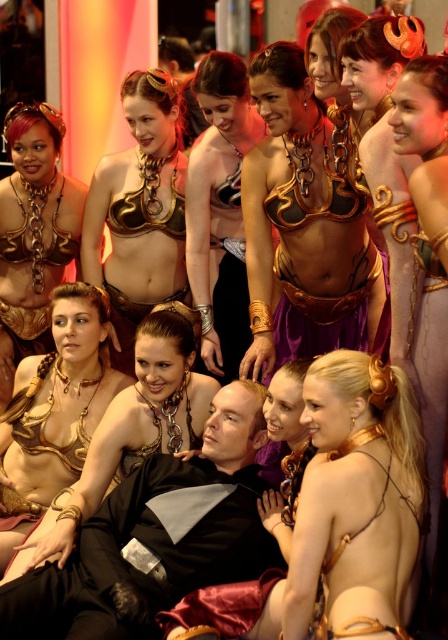
Question: Is gold chainmail bikini at center bigger than metallic gold bikini top at center?

Choices:
 (A) yes
 (B) no

Answer: (B)

Question: Which of the following is the farthest from the observer?

Choices:
 (A) (360, 145)
 (B) (153, 506)
 (C) (405, 104)
 (D) (56, 195)

Answer: (D)

Question: Is black matte suit at center smaller than metallic gold bikini top at center?

Choices:
 (A) no
 (B) yes

Answer: (A)

Question: Which point is closer to the camera?

Choices:
 (A) matte gold chainmail bikini top at upper center
 (B) gold chainmail bikini top at upper center
 (C) black matte suit at center
 (D) matte gold chainmail bikini top at center

Answer: (C)

Question: Which of the following is the farthest from the observer?

Choices:
 (A) (353, 54)
 (B) (268, 365)
 (C) (78, 184)
 (D) (42, 360)

Answer: (C)

Question: Can you confirm if matte gold chainmail bikini top at center is positioned above gold metallic armor at upper right?

Choices:
 (A) no
 (B) yes

Answer: (A)